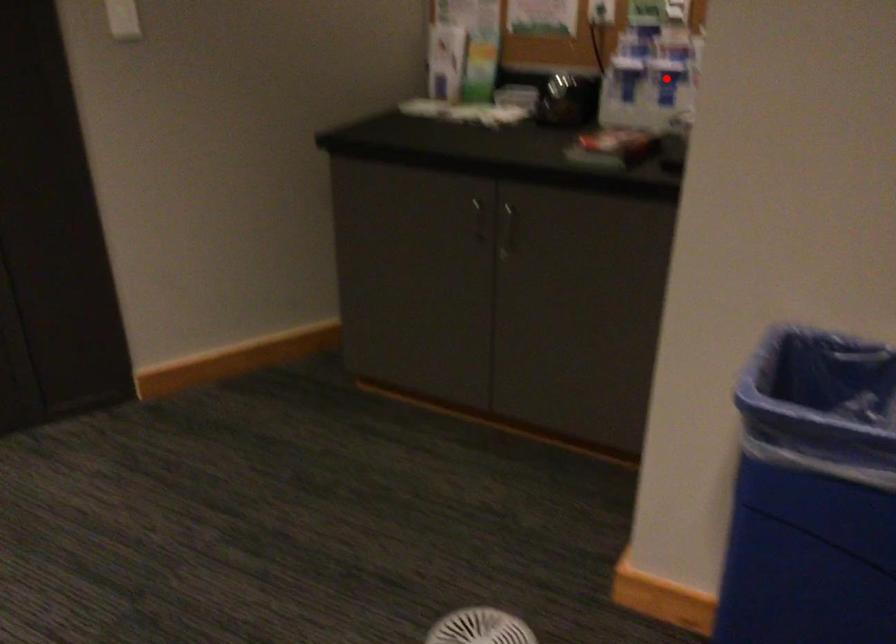
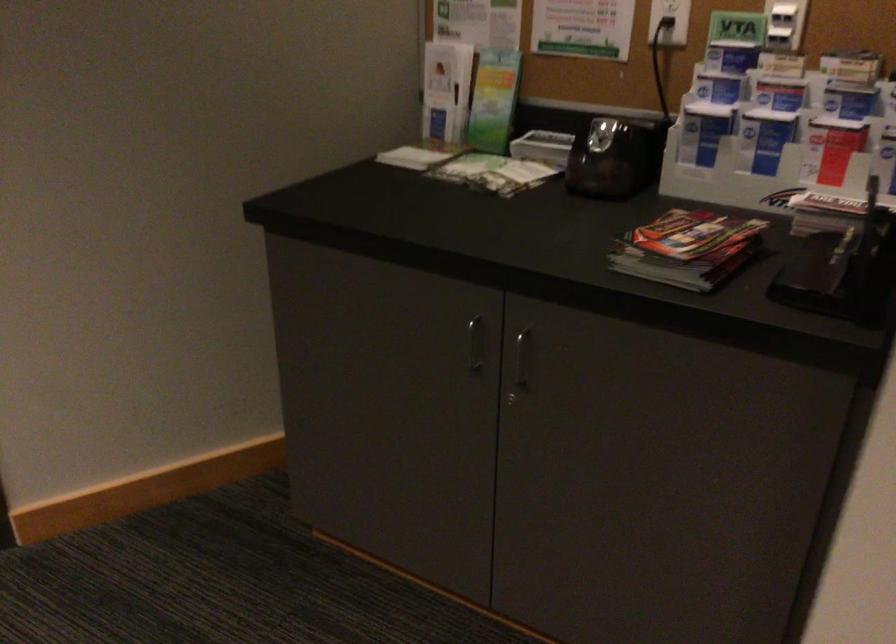
Question: I am providing you with two images of the same scene from different viewpoints. In image1, a red point is highlighted. Considering the same 3D point in image2, which of the following is correct?

Choices:
 (A) It is closer
 (B) It is farther

Answer: (A)